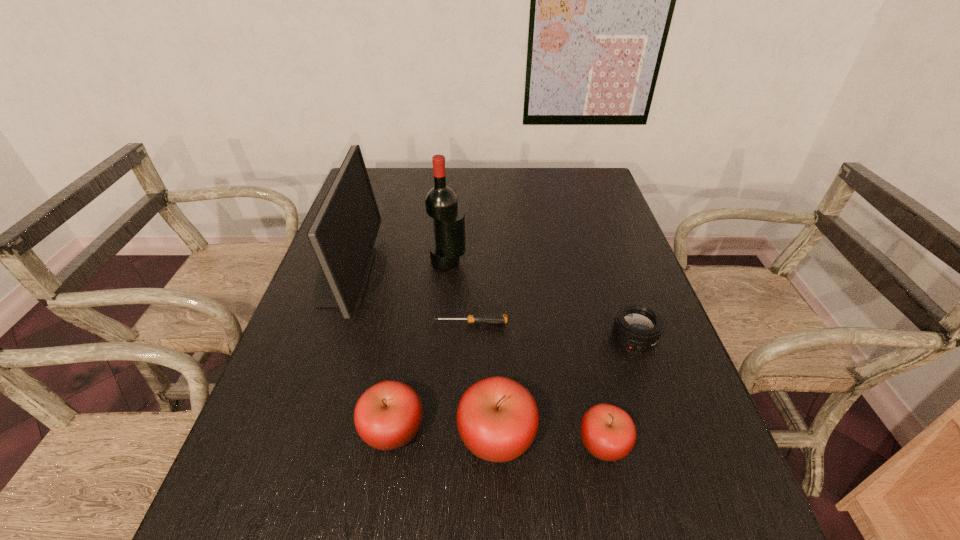
The height and width of the screenshot is (540, 960). I want to click on the second shortest apple, so click(x=387, y=416).

You are a GUI agent. You are given a task and a screenshot of the screen. Output one action in this format:
    pyautogui.click(x=<x>, y=<y>)
    Task: Click on the fourth tallest object
    The image size is (960, 540).
    Given the screenshot: What is the action you would take?
    pyautogui.click(x=387, y=416)

Where is `the tallest apple`? The image size is (960, 540). the tallest apple is located at coordinates (497, 418).

Locate an element on the screen. The image size is (960, 540). the second apple from left to right is located at coordinates (497, 418).

This screenshot has height=540, width=960. In order to click on the rightmost apple in this screenshot , I will do `click(608, 432)`.

Locate an element on the screen. the sixth object from left to right is located at coordinates (608, 432).

You are a GUI agent. You are given a task and a screenshot of the screen. Output one action in this format:
    pyautogui.click(x=<x>, y=<y>)
    Task: Click on the wine bottle
    
    Given the screenshot: What is the action you would take?
    point(441,203)

The width and height of the screenshot is (960, 540). In order to click on computer monitor in this screenshot , I will do `click(342, 235)`.

Locate an element on the screen. telephoto lens is located at coordinates (637, 326).

Locate an element on the screen. The height and width of the screenshot is (540, 960). the rightmost object is located at coordinates (637, 326).